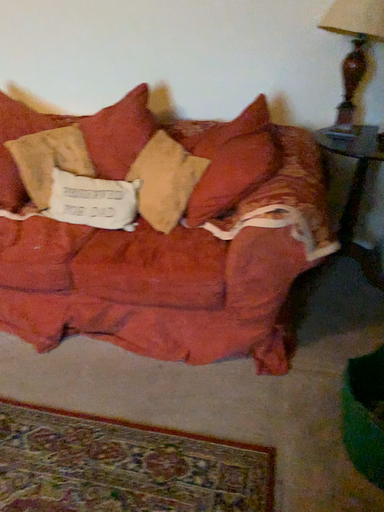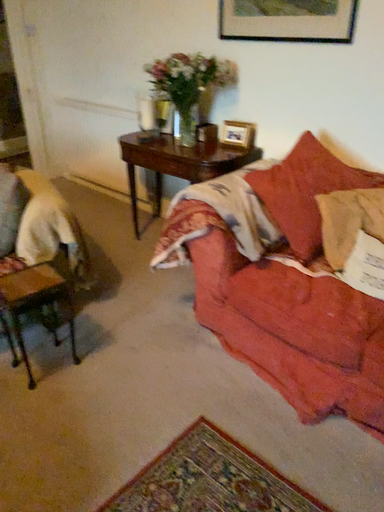
Question: How did the camera likely rotate when shooting the video?

Choices:
 (A) rotated right
 (B) rotated left

Answer: (B)